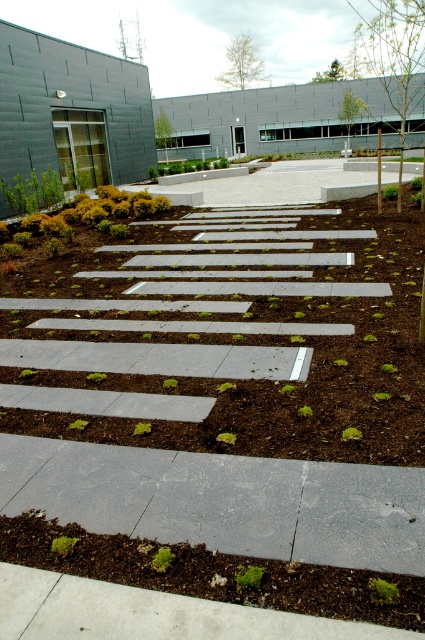
Question: Is brown mulch at center wider than green mulch at lower center?

Choices:
 (A) yes
 (B) no

Answer: (B)

Question: Which object appears closest to the camera in this image?

Choices:
 (A) green mulch at lower center
 (B) brown mulch at center

Answer: (A)

Question: Can you confirm if brown mulch at center is thinner than green mulch at lower center?

Choices:
 (A) yes
 (B) no

Answer: (A)

Question: Can you confirm if brown mulch at center is positioned above green mulch at lower center?

Choices:
 (A) yes
 (B) no

Answer: (A)